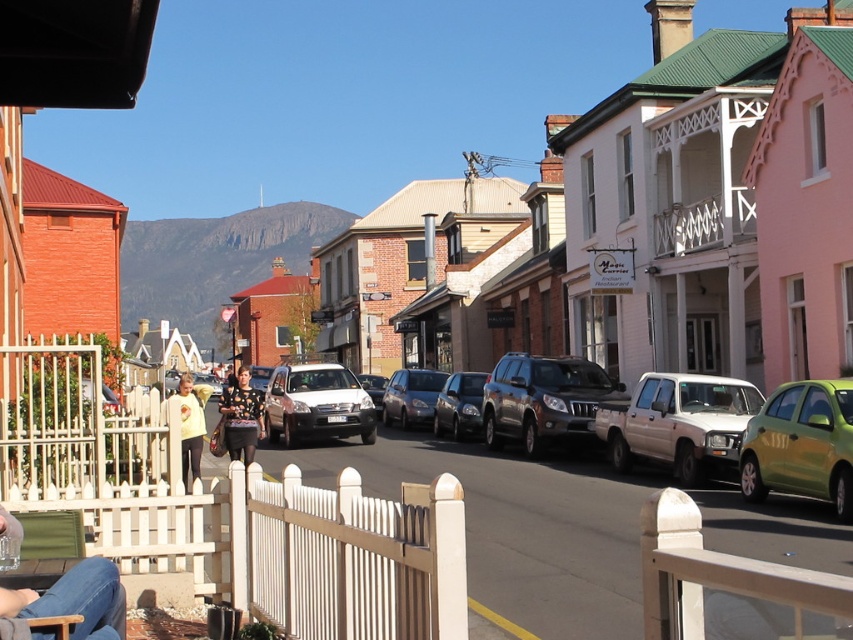
You are a delivery driver who needs to pass through the street shown in the scene. There is a shiny black suv at center and a satin silver sedan at center. Which vehicle should you move around to continue your route?

The shiny black suv at center is in front of the satin silver sedan at center, so you should move around the shiny black suv at center to continue your route.